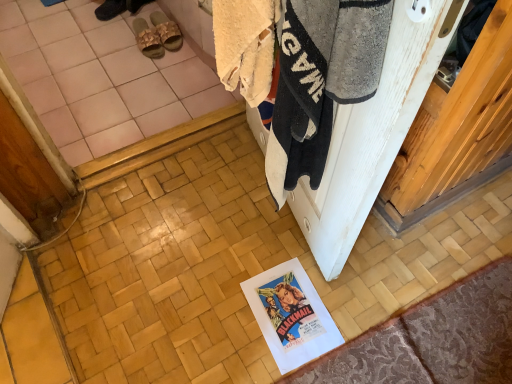
Find the location of a particular element. Image resolution: width=512 pixels, height=384 pixels. blank space situated above beige fabric slipper at upper left, which ranks as the second footwear in right-to-left order (from a real-world perspective) is located at coordinates (147, 31).